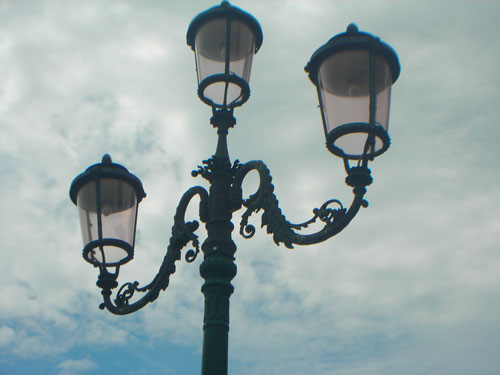
Where is `second light bulb`? The height and width of the screenshot is (375, 500). second light bulb is located at coordinates (223, 47).